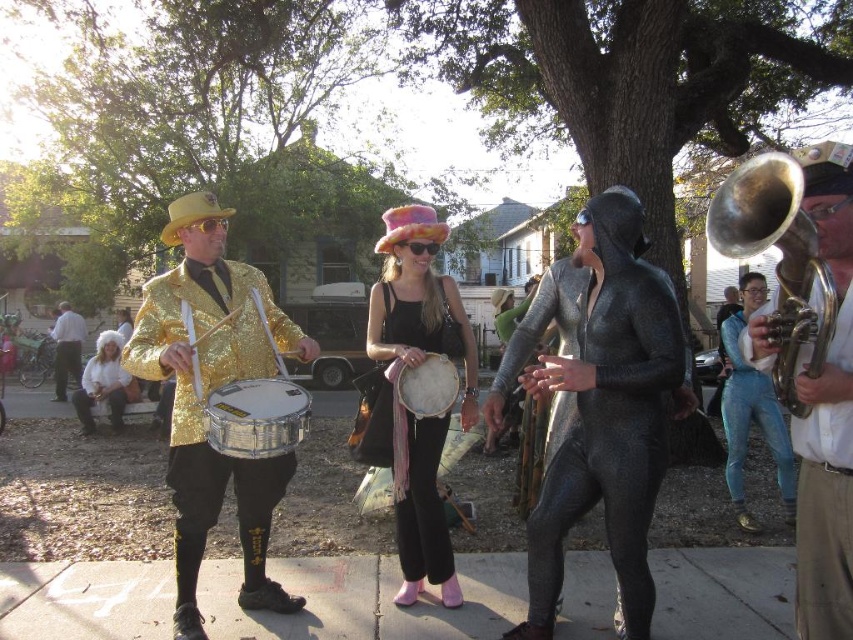
You are a photographer trying to capture a group photo of the blue metallic jumpsuit at center and the shiny gold jacket at left. Since you want to include both subjects in the frame, which one should you position closer to the camera to ensure both are visible?

The blue metallic jumpsuit at center is positioned on the right side of the shiny gold jacket at left, so to include both in the frame, position the shiny gold jacket at left closer to the camera.

You are a photographer trying to capture a photo of the shiny metallic suit at center and the white metallic drum at center. Since you want both objects in the frame, which one should you position closer to the left side of your camera viewfinder?

The white metallic drum at center should be positioned closer to the left side of the camera viewfinder because the shiny metallic suit at center is to the right of the white metallic drum at center.